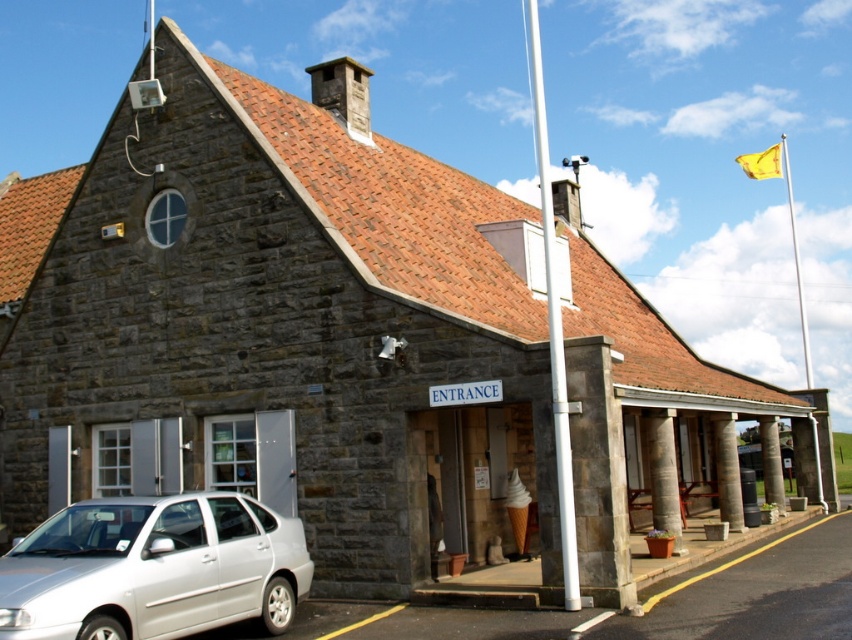
You are a visitor approaching the building and notice the silver metallic car at lower left and the yellow fabric flagpole at upper right. Which object is taller?

The yellow fabric flagpole at upper right is taller than the silver metallic car at lower left.

You are standing at the entrance of the stone building and want to place a new flag on the white metallic flag pole at center. However, you notice the brown stone pillar at lower right might block your view. Is the flag pole visible from your current position?

The white metallic flag pole at center is positioned over the brown stone pillar at lower right, so the flag pole is visible from your current position as it is placed above the pillar.

You are standing at the entrance of the stone building and notice two items at the upper right corner of the building. The items are labeled as yellow fabric flagpole at upper right and yellow fabric flag at upper right. Given that the flagpole is 52.63 feet away from the flag, can you determine if the flag is attached to the flagpole?

The yellow fabric flag at upper right is 52.63 feet away from the yellow fabric flagpole at upper right, which means the flag is not attached to the flagpole since they are too far apart.